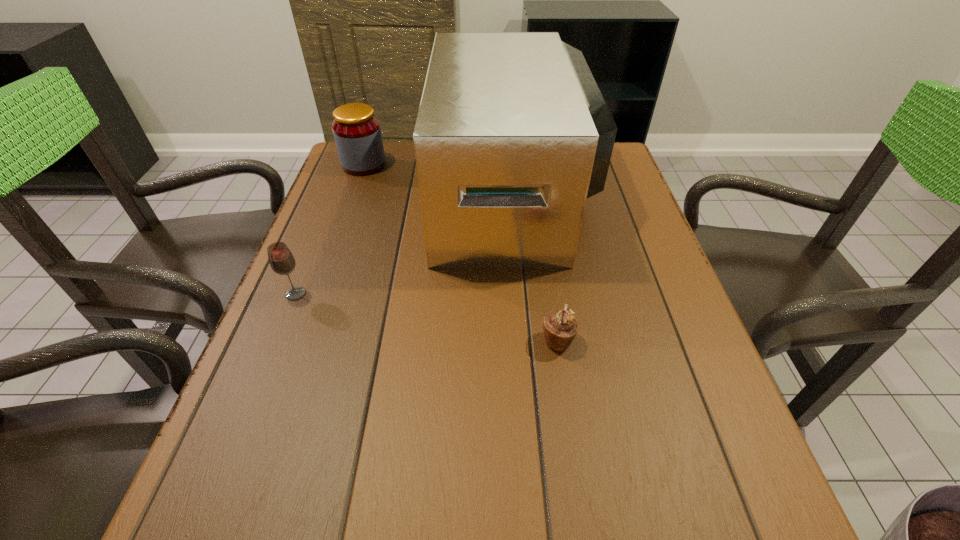
In the image, there is a desktop. Where is `vacant space at the left edge`? This screenshot has height=540, width=960. vacant space at the left edge is located at coordinates (283, 479).

Find the location of a particular element. The height and width of the screenshot is (540, 960). vacant area at the right edge of the desktop is located at coordinates (631, 191).

You are a GUI agent. You are given a task and a screenshot of the screen. Output one action in this format:
    pyautogui.click(x=<x>, y=<y>)
    Task: Click on the vacant space that is in between the second shortest object and the tallest object
    
    Given the screenshot: What is the action you would take?
    pyautogui.click(x=405, y=244)

Identify the location of vacant space in between the glass drink container and the microwave oven. (405, 244).

At what (x,y) coordinates should I click in order to perform the action: click on unoccupied position between the glass drink container and the second tallest object. Please return your answer as a coordinate pair (x, y). Looking at the image, I should click on (329, 229).

Where is `free spot between the second nearest object and the shortest object`? This screenshot has height=540, width=960. free spot between the second nearest object and the shortest object is located at coordinates pyautogui.click(x=426, y=317).

At what (x,y) coordinates should I click in order to perform the action: click on free space that is in between the shortest object and the second shortest object. Please return your answer as a coordinate pair (x, y). Looking at the image, I should click on (426, 317).

The height and width of the screenshot is (540, 960). I want to click on object that stands as the closest to the muffin, so coord(512,136).

In order to click on object that stands as the third closest to the glass drink container in this screenshot , I will do `click(560, 327)`.

The height and width of the screenshot is (540, 960). Find the location of `vacant space that satisfies the following two spatial constraints: 1. on the front-facing side of the tallest object; 2. on the back side of the shortest object`. vacant space that satisfies the following two spatial constraints: 1. on the front-facing side of the tallest object; 2. on the back side of the shortest object is located at coordinates (527, 341).